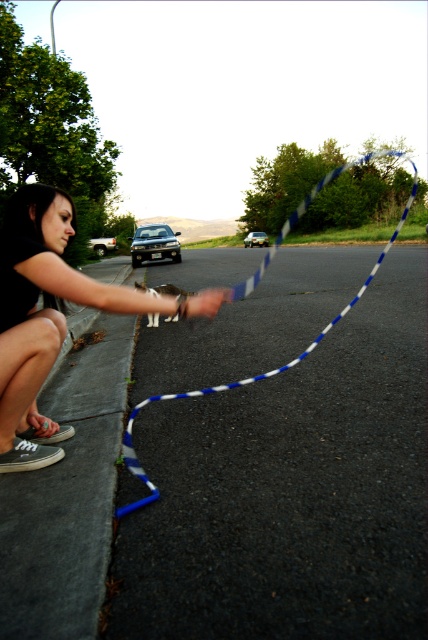
From the picture: Based on the scene description, where is the blue striped rope at center located in the image?

The blue striped rope at center is located at point coordinates of 0.594 on the x axis and 0.561 on the y axis.

You are a delivery driver who needs to park your car on the sidewalk near the blue striped rope at center and the silver metallic sedan at left. Can your car fit between them without overlapping either?

The blue striped rope at center is wider than the silver metallic sedan at left, so the space between them may not be sufficient for your car to park without overlapping. Check the exact measurements before deciding.

You are standing at the point closer to the camera in the image. Which point are you at, point (407, 202) or point (169, 243)?

You are at point (407, 202) because it is further to the camera than point (169, 243).